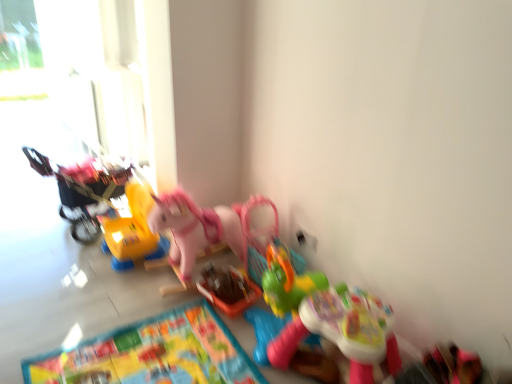
Find the location of a particular element. vacant area that lies between yellow plastic toy at center-left, which is the 2th toy from left to right, and multicolored fabric mat at lower center is located at coordinates (98, 303).